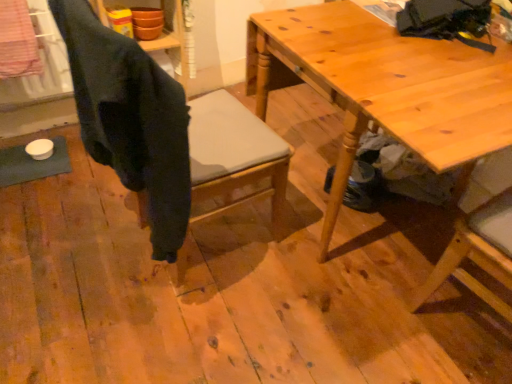
Question: Is dark gray fabric chair at center oriented towards wooden table at center?

Choices:
 (A) yes
 (B) no

Answer: (A)

Question: Does dark gray fabric chair at center have a greater width compared to wooden table at center?

Choices:
 (A) no
 (B) yes

Answer: (A)

Question: Does dark gray fabric chair at center have a lesser width compared to wooden table at center?

Choices:
 (A) yes
 (B) no

Answer: (A)

Question: Is dark gray fabric chair at center taller than wooden table at center?

Choices:
 (A) yes
 (B) no

Answer: (A)

Question: Is dark gray fabric chair at center next to wooden table at center and touching it?

Choices:
 (A) yes
 (B) no

Answer: (B)

Question: From a real-world perspective, is dark gray fabric chair at center on top of wooden table at center?

Choices:
 (A) yes
 (B) no

Answer: (A)

Question: From a real-world perspective, is wooden table at center below dark gray fabric chair at center?

Choices:
 (A) no
 (B) yes

Answer: (B)

Question: Does wooden table at center have a lesser width compared to dark gray fabric chair at center?

Choices:
 (A) yes
 (B) no

Answer: (B)

Question: Is wooden table at center oriented away from dark gray fabric chair at center?

Choices:
 (A) yes
 (B) no

Answer: (B)

Question: From a real-world perspective, does wooden table at center stand above dark gray fabric chair at center?

Choices:
 (A) no
 (B) yes

Answer: (A)

Question: Is the depth of wooden table at center greater than that of dark gray fabric chair at center?

Choices:
 (A) yes
 (B) no

Answer: (A)

Question: Is wooden table at center taller than dark gray fabric chair at center?

Choices:
 (A) yes
 (B) no

Answer: (B)

Question: From the image's perspective, is dark gray fabric chair at center above or below wooden table at center?

Choices:
 (A) above
 (B) below

Answer: (B)